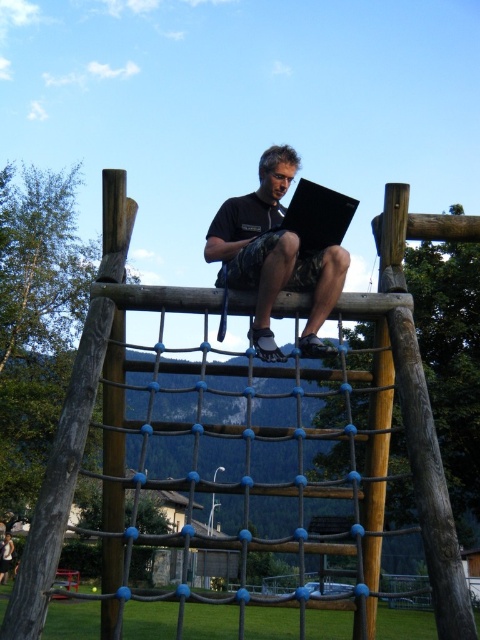
Does matte black laptop at center lie in front of black matte laptop at center?

That is False.

Does matte black laptop at center have a greater height compared to black matte laptop at center?

Yes.

Find the location of a particular element. The height and width of the screenshot is (640, 480). matte black laptop at center is located at coordinates (274, 257).

Where is `matte black laptop at center`? matte black laptop at center is located at coordinates (274, 257).

Who is higher up, brown wooden rope bridge at center or black matte laptop at center?

Positioned higher is black matte laptop at center.

Is brown wooden rope bridge at center above black matte laptop at center?

No, brown wooden rope bridge at center is not above black matte laptop at center.

The height and width of the screenshot is (640, 480). I want to click on brown wooden rope bridge at center, so click(x=245, y=438).

Is brown wooden rope bridge at center bigger than matte black laptop at center?

Correct, brown wooden rope bridge at center is larger in size than matte black laptop at center.

This screenshot has height=640, width=480. Identify the location of brown wooden rope bridge at center. (245, 438).